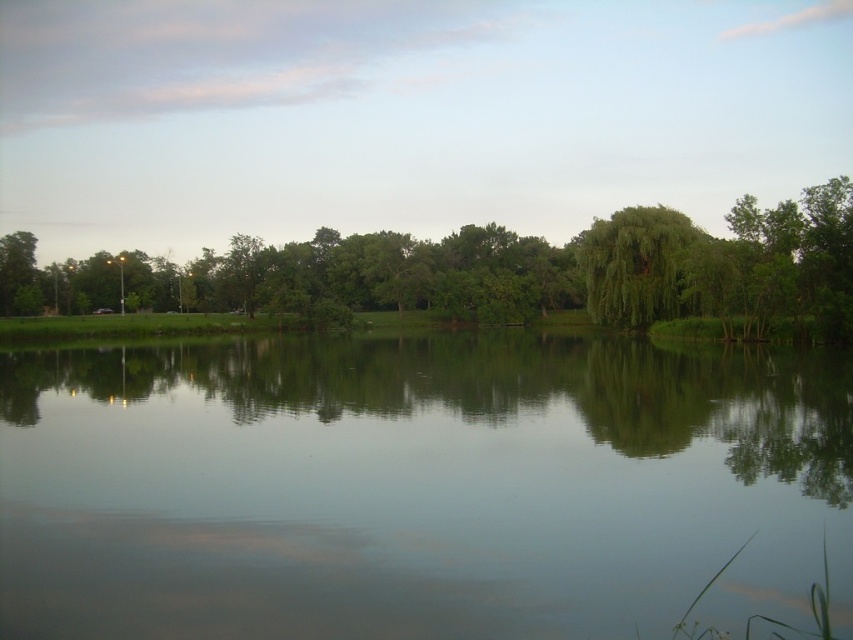
Question: Does transparent water at center have a lesser width compared to green leafy tree at center?

Choices:
 (A) no
 (B) yes

Answer: (B)

Question: Among these objects, which one is nearest to the camera?

Choices:
 (A) green leafy tree at upper right
 (B) transparent water at center
 (C) green leafy tree at center

Answer: (B)

Question: Which point is farther from the camera taking this photo?

Choices:
 (A) (601, 248)
 (B) (277, 611)

Answer: (A)

Question: Which of the following is the farthest from the observer?

Choices:
 (A) (677, 224)
 (B) (838, 202)
 (C) (247, 460)

Answer: (A)

Question: Can you confirm if transparent water at center is smaller than green leafy tree at upper right?

Choices:
 (A) yes
 (B) no

Answer: (A)

Question: Is transparent water at center positioned at the back of green leafy tree at center?

Choices:
 (A) no
 (B) yes

Answer: (A)